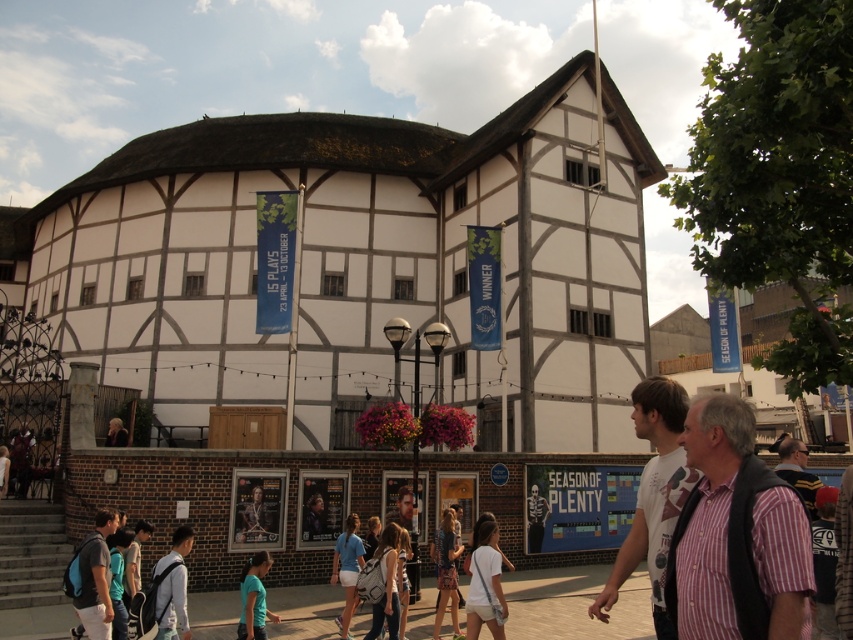
This screenshot has width=853, height=640. What do you see at coordinates (824, 563) in the screenshot?
I see `striped shirt at lower right` at bounding box center [824, 563].

Is point (830, 536) in front of point (361, 548)?

Yes, point (830, 536) is closer to viewer.

Does point (819, 616) lie behind point (354, 564)?

No, it is not.

Where is `striped shirt at lower right`? The height and width of the screenshot is (640, 853). striped shirt at lower right is located at coordinates (824, 563).

Is white fabric backpack at center above blonde hair at lower left?

Incorrect, white fabric backpack at center is not positioned above blonde hair at lower left.

Does white fabric backpack at center appear on the right side of blonde hair at lower left?

Yes, white fabric backpack at center is to the right of blonde hair at lower left.

Who is more distant from viewer, [383,552] or [109,442]?

The point [109,442] is behind.

In order to click on white fabric backpack at center in this screenshot , I will do click(x=386, y=582).

Does light blue backpack at lower left have a lesser height compared to white cotton shirt at center?

Correct, light blue backpack at lower left is not as tall as white cotton shirt at center.

Does point (96, 560) come closer to viewer compared to point (474, 532)?

Yes, it is.

The width and height of the screenshot is (853, 640). Describe the element at coordinates (96, 577) in the screenshot. I see `light blue backpack at lower left` at that location.

At what (x,y) coordinates should I click in order to perform the action: click on light blue backpack at lower left. Please return your answer as a coordinate pair (x, y). The image size is (853, 640). Looking at the image, I should click on (96, 577).